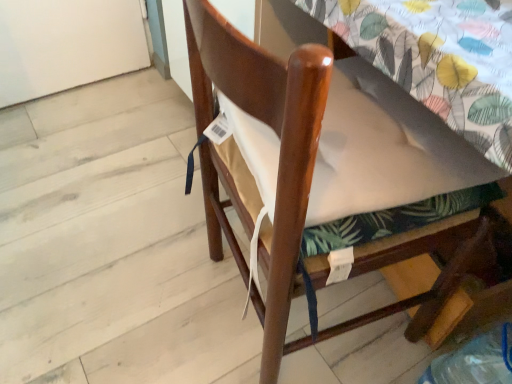
This screenshot has height=384, width=512. Describe the element at coordinates (308, 143) in the screenshot. I see `matte brown chair at center` at that location.

At what (x,y) coordinates should I click in order to perform the action: click on matte brown chair at center. Please return your answer as a coordinate pair (x, y). Looking at the image, I should click on (308, 143).

In order to face matte brown chair at center, should I rotate leftwards or rightwards?

Rotate your view right by about 8.846°.

Identify the location of matte brown chair at center. coord(308,143).